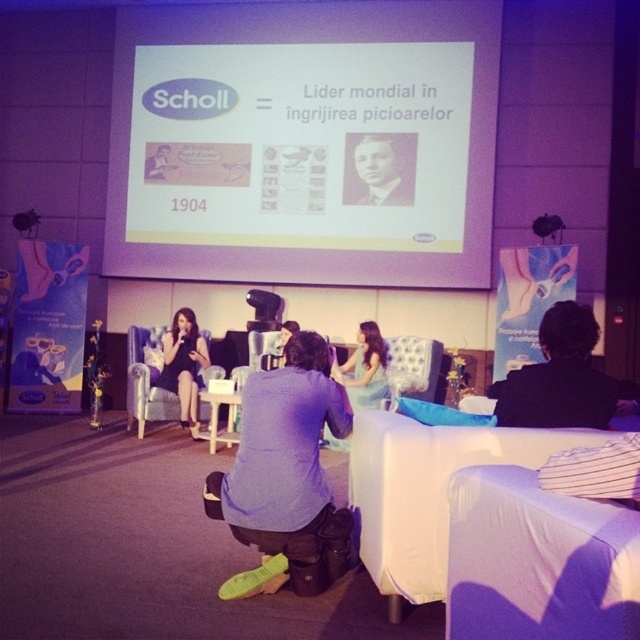
Question: Among these points, which one is nearest to the camera?

Choices:
 (A) (184, 394)
 (B) (376, 189)
 (C) (394, 257)
 (D) (616, 385)

Answer: (D)

Question: Can you confirm if white matte projection screen at center is thinner than purple fabric shirt at center?

Choices:
 (A) yes
 (B) no

Answer: (B)

Question: Which point appears farthest from the camera in this image?

Choices:
 (A) (360, 364)
 (B) (392, 140)

Answer: (B)

Question: Which object is positioned closest to the purple fabric shirt at center?

Choices:
 (A) black satin dress at lower left
 (B) white matte projection screen at center
 (C) black and white photograph of man at upper center

Answer: (A)

Question: Does purple fabric shirt at center have a greater width compared to black fabric jacket at center?

Choices:
 (A) no
 (B) yes

Answer: (B)

Question: Is the position of black fabric jacket at center more distant than that of black satin dress at lower left?

Choices:
 (A) no
 (B) yes

Answer: (A)